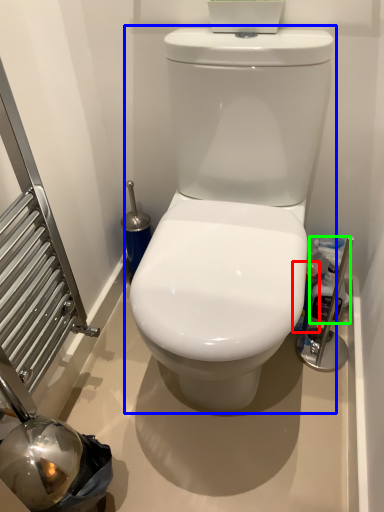
Question: Based on their relative distances, which object is farther from cleaning product (highlighted by a red box)? Choose from toilet (highlighted by a blue box) and cleaning product (highlighted by a green box).

Choices:
 (A) toilet
 (B) cleaning product

Answer: (A)